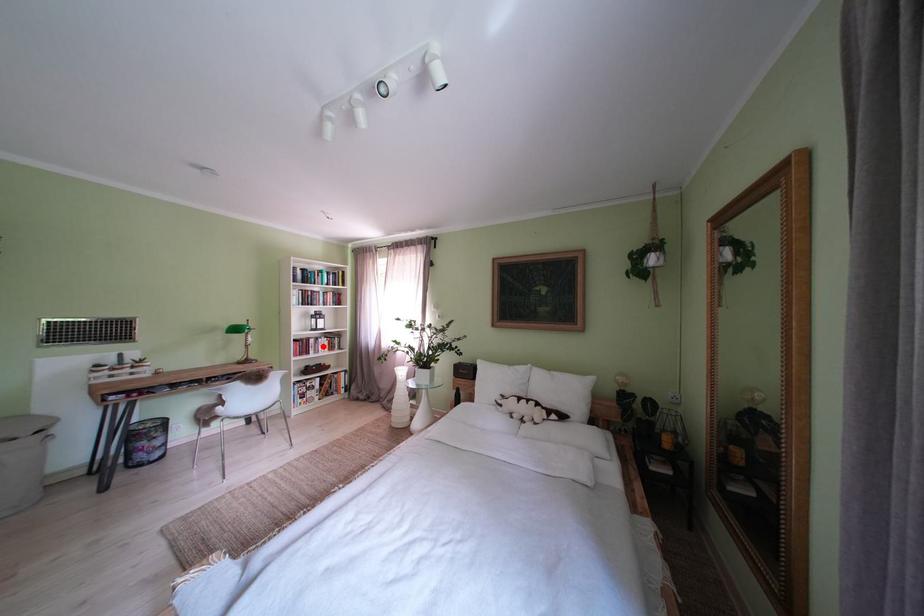
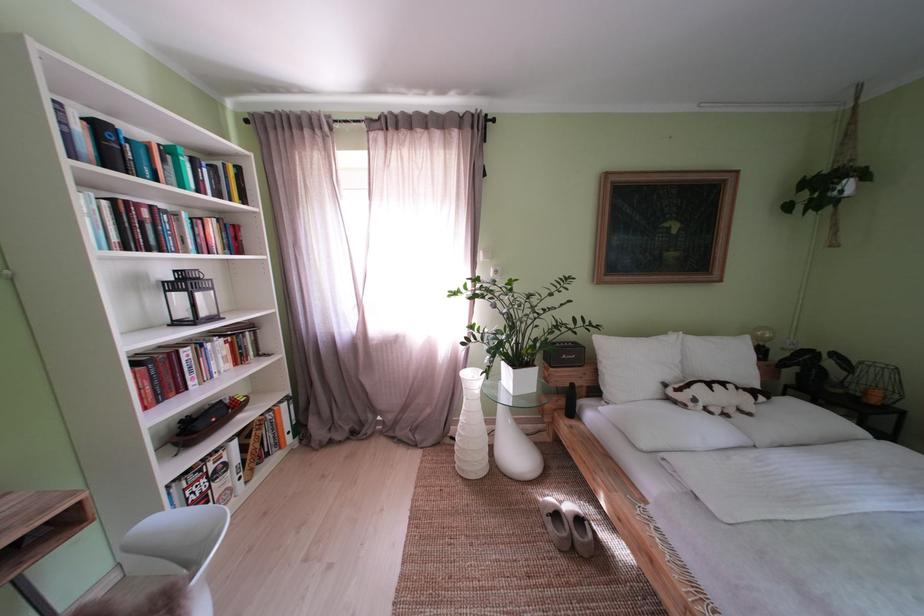
In the second image, find the point that corresponds to the highlighted location in the first image.

(199, 359)